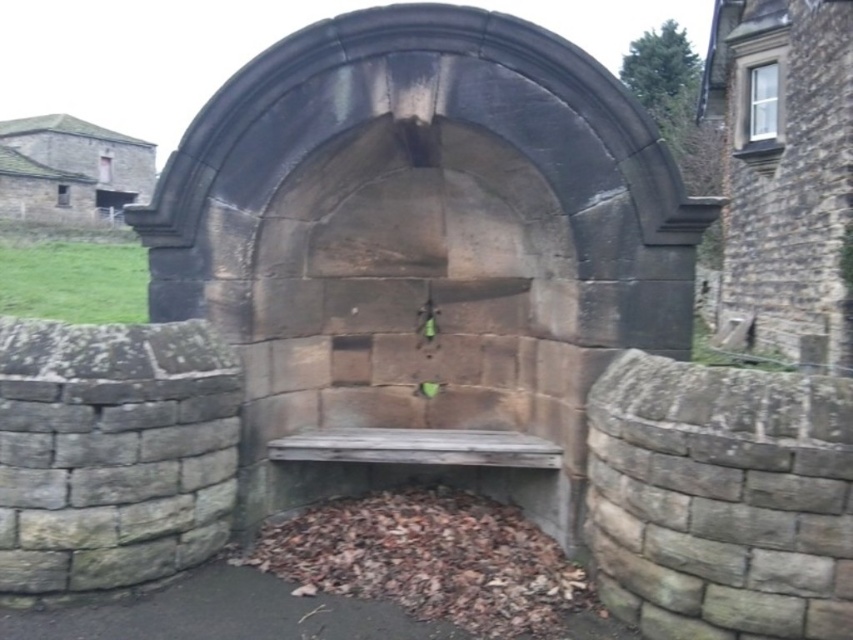
Question: Is stone archway at center bigger than weathered wood bench at center?

Choices:
 (A) yes
 (B) no

Answer: (A)

Question: Considering the relative positions of stone archway at center and weathered wood bench at center in the image provided, where is stone archway at center located with respect to weathered wood bench at center?

Choices:
 (A) below
 (B) above

Answer: (B)

Question: Which point is farther to the camera?

Choices:
 (A) weathered wood bench at center
 (B) stone archway at center

Answer: (A)

Question: Is stone archway at center above weathered wood bench at center?

Choices:
 (A) no
 (B) yes

Answer: (B)

Question: Which object is farther from the camera taking this photo?

Choices:
 (A) weathered wood bench at center
 (B) stone archway at center

Answer: (A)